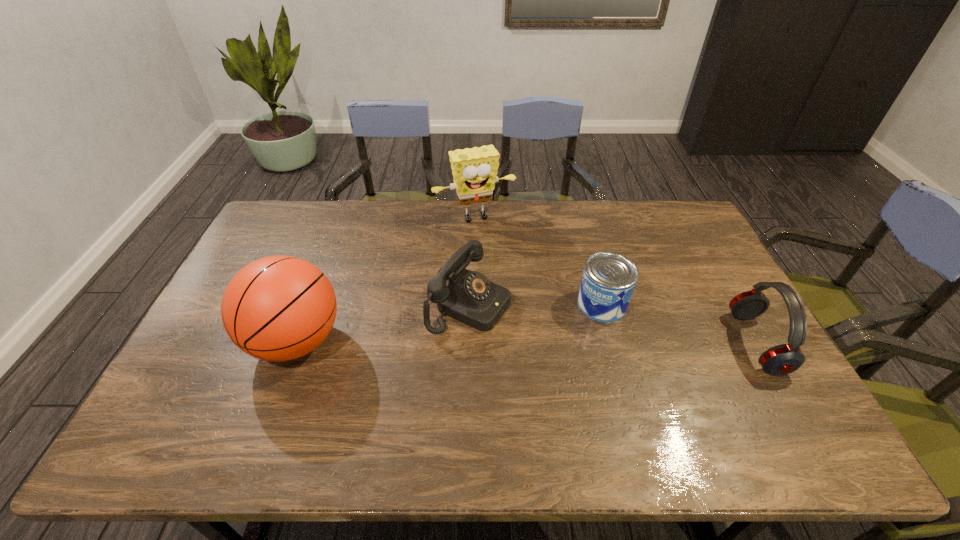
You are a GUI agent. You are given a task and a screenshot of the screen. Output one action in this format:
    pyautogui.click(x=<x>, y=<y>)
    Task: Click on the blank space located on the dial of the telephone
    This screenshot has width=960, height=540.
    Given the screenshot: What is the action you would take?
    pyautogui.click(x=567, y=347)

Locate an element on the screen. This screenshot has height=540, width=960. vacant space located on the dial of the telephone is located at coordinates (588, 356).

In order to click on vacant space located on the dial of the telephone in this screenshot , I will do `click(570, 348)`.

This screenshot has height=540, width=960. What are the coordinates of `vacant region located 0.260m on the front-facing side of the sponge` in the screenshot? It's located at (511, 276).

Find the location of `vacant space positioned 0.080m on the front-facing side of the sponge`. vacant space positioned 0.080m on the front-facing side of the sponge is located at coordinates (493, 242).

Locate an element on the screen. vacant region located 0.070m on the front-facing side of the sponge is located at coordinates click(492, 240).

Image resolution: width=960 pixels, height=540 pixels. Find the location of `free space located 0.120m on the front label of the can`. free space located 0.120m on the front label of the can is located at coordinates (551, 331).

You are a GUI agent. You are given a task and a screenshot of the screen. Output one action in this format:
    pyautogui.click(x=<x>, y=<y>)
    Task: Click on the vacant region located 0.280m on the front label of the can
    
    Given the screenshot: What is the action you would take?
    pyautogui.click(x=504, y=356)

You are a GUI agent. You are given a task and a screenshot of the screen. Output one action in this format:
    pyautogui.click(x=<x>, y=<y>)
    Task: Click on the free space located on the front label of the can
    The width and height of the screenshot is (960, 540).
    Given the screenshot: What is the action you would take?
    pyautogui.click(x=472, y=373)

Find the location of a particular element. object that is at the far edge is located at coordinates (474, 170).